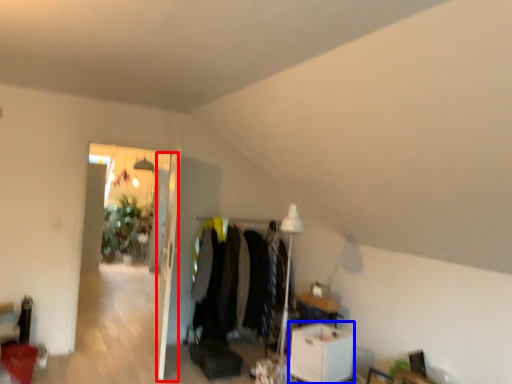
Question: Which object is further to the camera taking this photo, door (highlighted by a red box) or table (highlighted by a blue box)?

Choices:
 (A) door
 (B) table

Answer: (A)